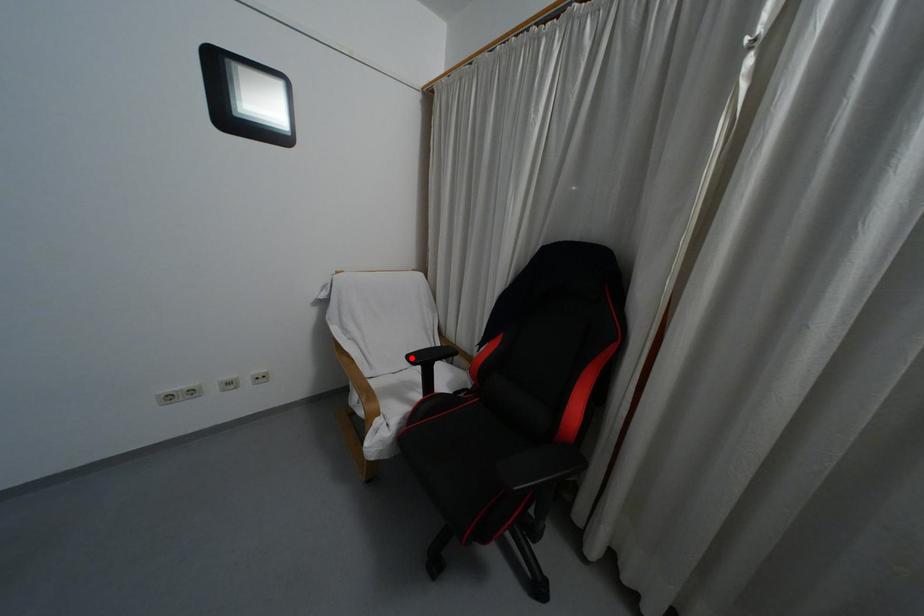
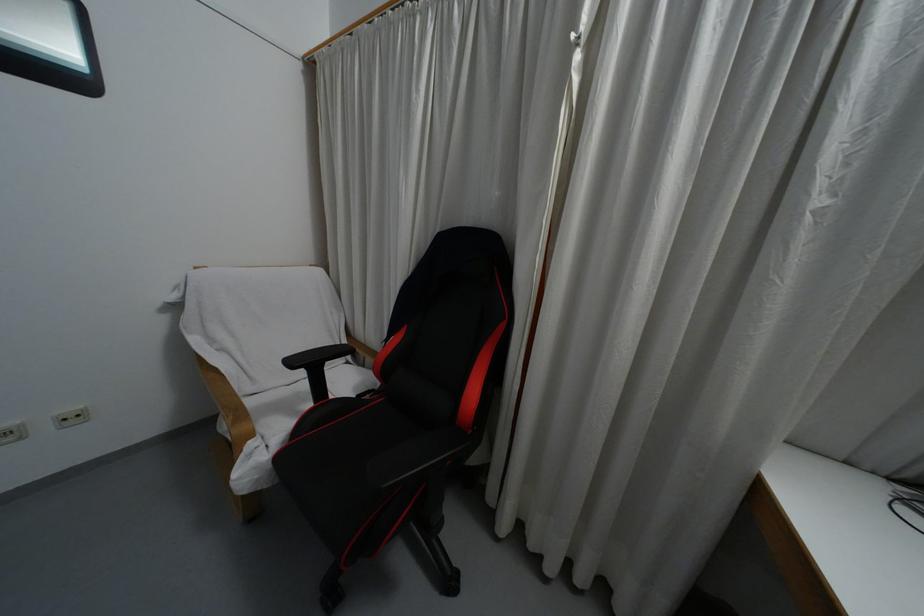
In the second image, find the point that corresponds to the highlighted location in the first image.

(292, 362)